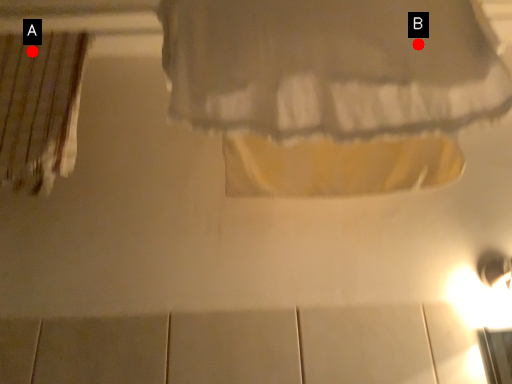
Question: Two points are circled on the image, labeled by A and B beside each circle. Which point is closer to the camera taking this photo?

Choices:
 (A) A is closer
 (B) B is closer

Answer: (B)